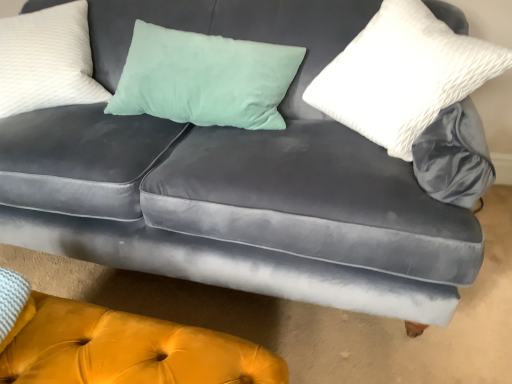
Question: Does white textured pillow at upper right, positioned as the 2th pillow in left-to-right order, have a smaller size compared to white textured pillow at upper left, positioned as the 1th pillow in left-to-right order?

Choices:
 (A) no
 (B) yes

Answer: (B)

Question: Is white textured pillow at upper left, positioned as the 1th pillow in left-to-right order, a part of white textured pillow at upper right, positioned as the 2th pillow in left-to-right order?

Choices:
 (A) no
 (B) yes

Answer: (A)

Question: Is white textured pillow at upper right, arranged as the 1th pillow when viewed from the right, with white textured pillow at upper left, positioned as the 1th pillow in left-to-right order?

Choices:
 (A) no
 (B) yes

Answer: (A)

Question: Considering the relative sizes of white textured pillow at upper right, arranged as the 1th pillow when viewed from the right, and white textured pillow at upper left, positioned as the 1th pillow in left-to-right order, in the image provided, is white textured pillow at upper right, arranged as the 1th pillow when viewed from the right, wider than white textured pillow at upper left, positioned as the 1th pillow in left-to-right order,?

Choices:
 (A) no
 (B) yes

Answer: (A)

Question: From a real-world perspective, is white textured pillow at upper right, arranged as the 1th pillow when viewed from the right, positioned over white textured pillow at upper left, positioned as the 1th pillow in left-to-right order, based on gravity?

Choices:
 (A) no
 (B) yes

Answer: (B)

Question: From a real-world perspective, is white textured pillow at upper right, arranged as the 1th pillow when viewed from the right, above or below white textured pillow at upper left, the second pillow from the right?

Choices:
 (A) above
 (B) below

Answer: (A)

Question: In terms of height, does white textured pillow at upper right, positioned as the 2th pillow in left-to-right order, look taller or shorter compared to white textured pillow at upper left, the second pillow from the right?

Choices:
 (A) short
 (B) tall

Answer: (B)

Question: From the image's perspective, is white textured pillow at upper right, positioned as the 2th pillow in left-to-right order, above or below white textured pillow at upper left, the second pillow from the right?

Choices:
 (A) above
 (B) below

Answer: (B)

Question: Is white textured pillow at upper right, arranged as the 1th pillow when viewed from the right, bigger or smaller than white textured pillow at upper left, positioned as the 1th pillow in left-to-right order?

Choices:
 (A) small
 (B) big

Answer: (A)

Question: Would you say white textured pillow at upper right, arranged as the 1th pillow when viewed from the right, is inside or outside velvet yellow ottoman at lower center?

Choices:
 (A) inside
 (B) outside

Answer: (B)

Question: From the image's perspective, is white textured pillow at upper right, arranged as the 1th pillow when viewed from the right, above or below velvet yellow ottoman at lower center?

Choices:
 (A) above
 (B) below

Answer: (A)

Question: Is white textured pillow at upper right, positioned as the 2th pillow in left-to-right order, in front of or behind velvet yellow ottoman at lower center in the image?

Choices:
 (A) front
 (B) behind

Answer: (B)

Question: Considering the positions of point (429, 54) and point (26, 347), is point (429, 54) closer or farther from the camera than point (26, 347)?

Choices:
 (A) closer
 (B) farther

Answer: (B)

Question: In terms of height, does white textured pillow at upper left, the second pillow from the right, look taller or shorter compared to velvet yellow ottoman at lower center?

Choices:
 (A) tall
 (B) short

Answer: (A)

Question: Looking at their shapes, would you say white textured pillow at upper left, the second pillow from the right, is wider or thinner than velvet yellow ottoman at lower center?

Choices:
 (A) wide
 (B) thin

Answer: (B)